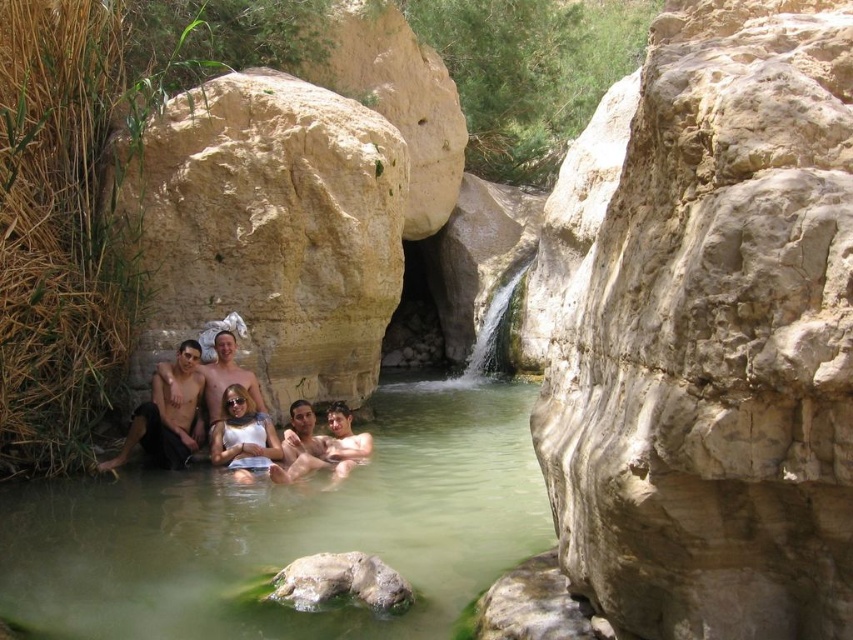
Question: Which object is positioned farthest from the smooth tan skin at center?

Choices:
 (A) smooth skin man at center
 (B) smooth skin man at left
 (C) matte skin people at center

Answer: (A)

Question: Does green translucent water at center appear under matte skin people at center?

Choices:
 (A) no
 (B) yes

Answer: (B)

Question: Which object is farther from the camera taking this photo?

Choices:
 (A) smooth skin man at center
 (B) smooth skin man at left
 (C) green translucent water at center
 (D) smooth tan skin at center

Answer: (D)

Question: Does green translucent water at center appear on the right side of matte skin people at center?

Choices:
 (A) no
 (B) yes

Answer: (B)

Question: Which object appears farthest from the camera in this image?

Choices:
 (A) smooth skin man at center
 (B) smooth skin man at left
 (C) green translucent water at center
 (D) matte skin people at center

Answer: (D)

Question: Is matte skin people at center positioned before smooth skin man at center?

Choices:
 (A) no
 (B) yes

Answer: (A)